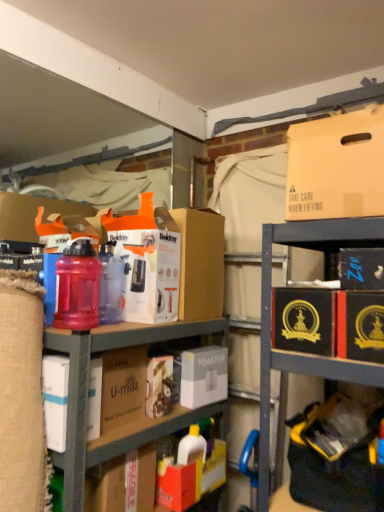
Question: From the image's perspective, is matte plastic bottles at center on top of orange matte cardboard box at center, arranged as the first cardboard box when viewed from the back?

Choices:
 (A) no
 (B) yes

Answer: (A)

Question: From the image's perspective, is matte plastic bottles at center beneath orange matte cardboard box at center, the 1th cardboard box when ordered from left to right?

Choices:
 (A) yes
 (B) no

Answer: (A)

Question: Is matte plastic bottles at center not near orange matte cardboard box at center, which is the second cardboard box from front to back?

Choices:
 (A) no
 (B) yes

Answer: (A)

Question: Would you say matte plastic bottles at center contains orange matte cardboard box at center, arranged as the first cardboard box when viewed from the back?

Choices:
 (A) no
 (B) yes

Answer: (A)

Question: Is matte plastic bottles at center oriented towards orange matte cardboard box at center, arranged as the first cardboard box when viewed from the back?

Choices:
 (A) yes
 (B) no

Answer: (B)

Question: Considering the relative sizes of matte plastic bottles at center and orange matte cardboard box at center, the 1th cardboard box when ordered from left to right, in the image provided, is matte plastic bottles at center bigger than orange matte cardboard box at center, the 1th cardboard box when ordered from left to right,?

Choices:
 (A) yes
 (B) no

Answer: (A)

Question: Considering the relative sizes of translucent plastic water bottle at left and black cardboard box at upper right, the second storage box positioned from the left, in the image provided, is translucent plastic water bottle at left taller than black cardboard box at upper right, the second storage box positioned from the left,?

Choices:
 (A) yes
 (B) no

Answer: (A)

Question: From the image's perspective, does translucent plastic water bottle at left appear higher than black cardboard box at upper right, which appears as the second storage box when viewed from the right?

Choices:
 (A) no
 (B) yes

Answer: (A)

Question: From a real-world perspective, is translucent plastic water bottle at left on top of black cardboard box at upper right, the third storage box ordered from the bottom?

Choices:
 (A) yes
 (B) no

Answer: (B)

Question: Does translucent plastic water bottle at left have a greater width compared to black cardboard box at upper right, positioned as the first storage box in top-to-bottom order?

Choices:
 (A) no
 (B) yes

Answer: (A)

Question: Is translucent plastic water bottle at left shorter than black cardboard box at upper right, positioned as the first storage box in top-to-bottom order?

Choices:
 (A) no
 (B) yes

Answer: (A)

Question: Is translucent plastic water bottle at left oriented towards black cardboard box at upper right, the third storage box ordered from the bottom?

Choices:
 (A) no
 (B) yes

Answer: (A)

Question: Is matte cardboard box at upper right to the right of orange matte cardboard box at center, the 1th cardboard box when ordered from left to right, from the viewer's perspective?

Choices:
 (A) no
 (B) yes

Answer: (B)